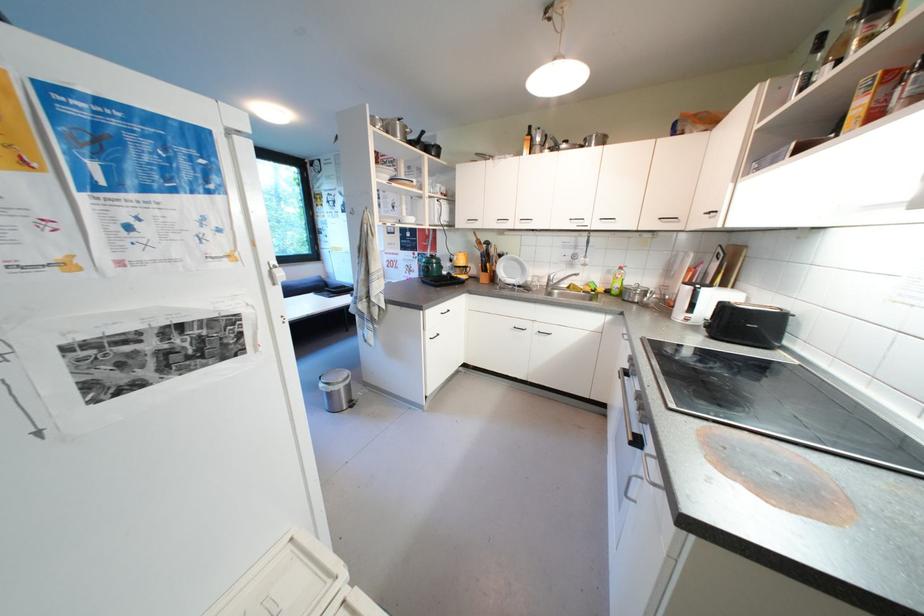
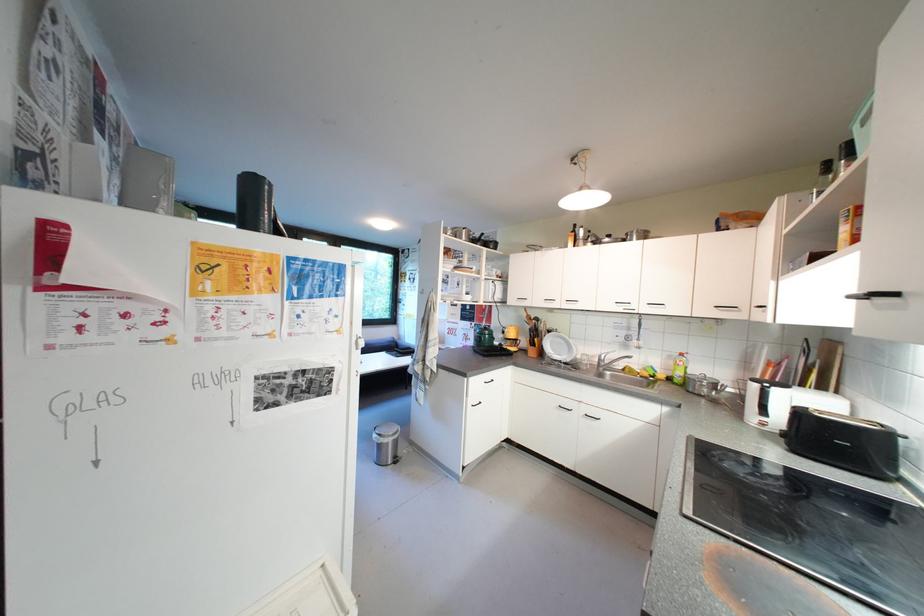
The point at (x=458, y=227) is marked in the first image. Where is the corresponding point in the second image?

(512, 304)